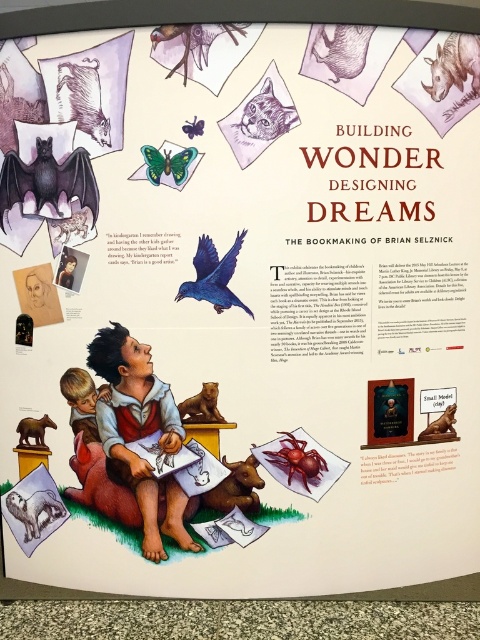
You are a museum visitor standing in front of the poster. You want to know if you can fit both the green matte butterfly at upper center and the brown matte animal at lower left in a rectangular frame that measures 80 centimeters in width. Can you determine if they will fit side by side horizontally?

The green matte butterfly at upper center is 74.38 centimeters from the brown matte animal at lower left. Since the distance between them is less than the frame width of 80 centimeters, they can fit side by side horizontally in the frame.

You are a photographer trying to capture the vibrant poster. You notice two points on the poster at coordinates point (155, 180) and point (24, 436). Which point will appear larger in your photo?

Point (155, 180) is closer to the camera than point (24, 436), so it will appear larger in the photo.

You are standing 2 meters away from the poster and want to touch the point at coordinates point (58, 92). Can you reach it without moving closer?

The distance of point (58, 92) from camera is 1.59 meters, so you are currently 2 meters away from the poster. Since the point is closer to you than your current position, you can reach it without moving closer.